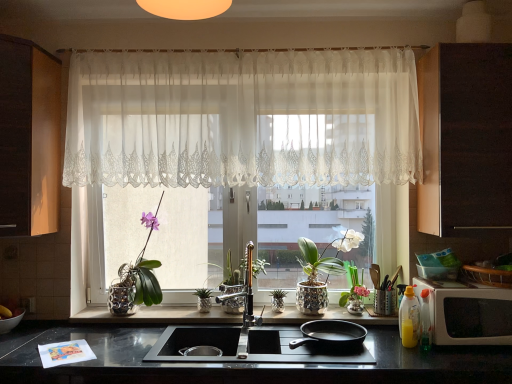
At what (x,y) coordinates should I click in order to perform the action: click on free space in front of translucent plastic bottle at lower right. Please return your answer as a coordinate pair (x, y). The height and width of the screenshot is (384, 512). Looking at the image, I should click on (430, 360).